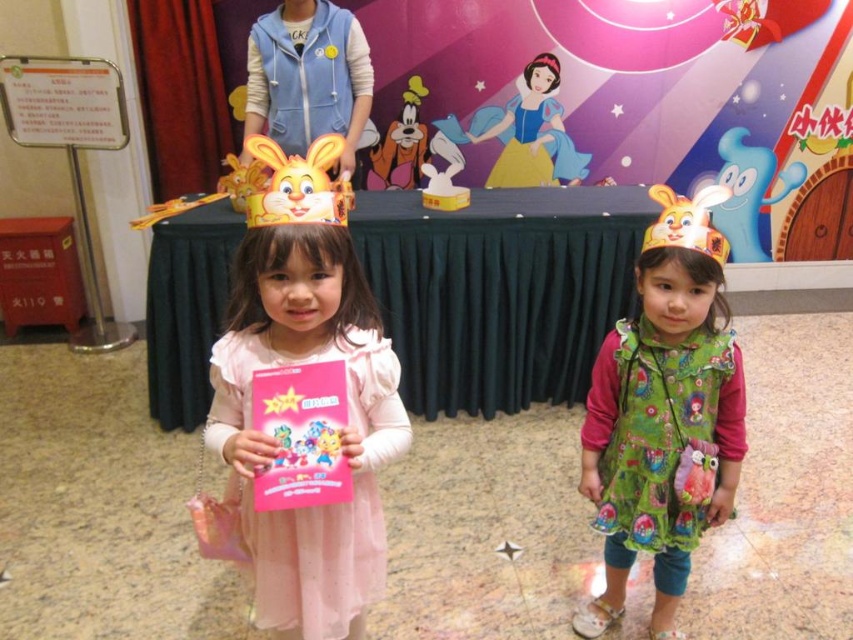
Question: Which object appears closest to the camera in this image?

Choices:
 (A) pink satin dress at center
 (B) matte yellow paper crown at upper right
 (C) blue satin dress at upper center

Answer: (A)

Question: Among these objects, which one is farthest from the camera?

Choices:
 (A) green fabric dress at right
 (B) matte green dress at center
 (C) matte yellow paper crown at upper right
 (D) yellow paper bunny at center

Answer: (A)

Question: Can you confirm if matte green dress at center is smaller than pink satin dress at center?

Choices:
 (A) no
 (B) yes

Answer: (A)

Question: Does green fabric dress at right appear over yellow paper bunny at center?

Choices:
 (A) no
 (B) yes

Answer: (A)

Question: Estimate the real-world distances between objects in this image. Which object is farther from the matte green dress at center?

Choices:
 (A) blue satin dress at upper center
 (B) pink satin dress at center
 (C) green fabric dress at right

Answer: (A)

Question: Can you confirm if matte yellow paper crown at upper right is positioned above blue satin dress at upper center?

Choices:
 (A) no
 (B) yes

Answer: (A)